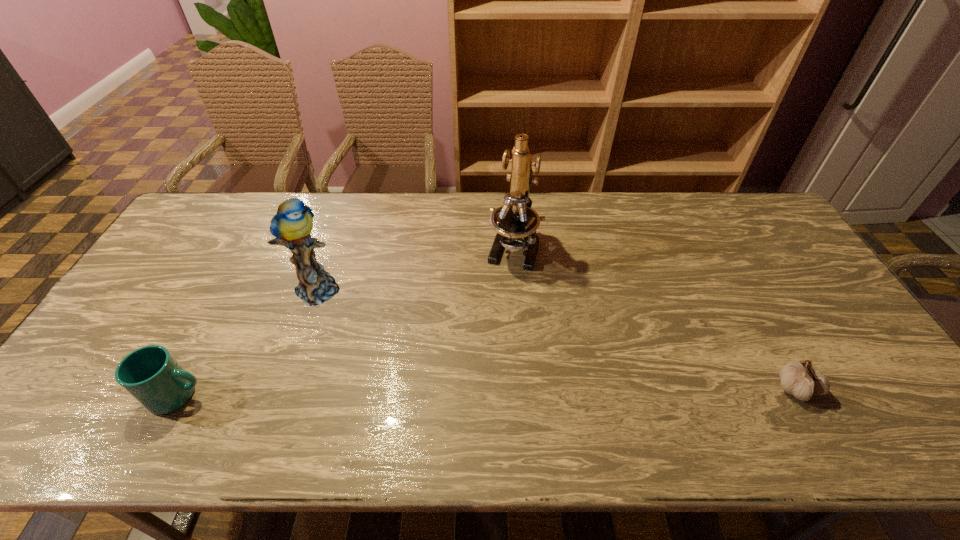
You are a GUI agent. You are given a task and a screenshot of the screen. Output one action in this format:
    pyautogui.click(x=<x>, y=<y>)
    Task: Click on the vacant space located 0.190m on the face of the parrot
    This screenshot has width=960, height=540.
    Given the screenshot: What is the action you would take?
    pyautogui.click(x=384, y=328)

Where is `vacant space located on the face of the parrot`? The height and width of the screenshot is (540, 960). vacant space located on the face of the parrot is located at coordinates (360, 313).

Locate an element on the screen. blank space located 0.250m on the face of the parrot is located at coordinates (400, 338).

What are the coordinates of `object that is at the far edge` in the screenshot? It's located at (515, 222).

Locate an element on the screen. The image size is (960, 540). cup that is at the near edge is located at coordinates (151, 375).

Identify the location of garlic at the near edge. (800, 379).

Locate an element on the screen. This screenshot has height=540, width=960. vacant space at the far edge is located at coordinates (588, 206).

Locate an element on the screen. The width and height of the screenshot is (960, 540). vacant point at the near edge is located at coordinates (579, 377).

This screenshot has width=960, height=540. Find the location of `free region at the right edge`. free region at the right edge is located at coordinates (810, 294).

At what (x,y) coordinates should I click in order to perform the action: click on vacant space at the far left corner of the desktop. Please return your answer as a coordinate pair (x, y). Image resolution: width=960 pixels, height=540 pixels. Looking at the image, I should click on (230, 221).